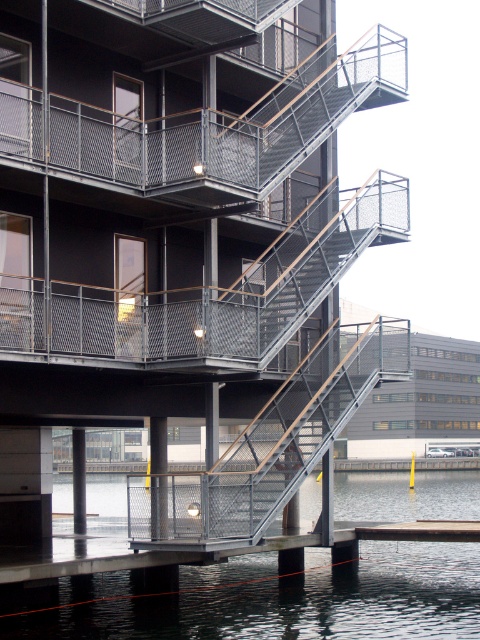
Question: Is metallic gray water at lower center to the right of black mesh balcony at upper center from the viewer's perspective?

Choices:
 (A) no
 (B) yes

Answer: (B)

Question: Does metallic gray water at lower center have a greater width compared to black mesh balcony at upper center?

Choices:
 (A) yes
 (B) no

Answer: (A)

Question: Is metallic gray water at lower center in front of black mesh balcony at upper center?

Choices:
 (A) yes
 (B) no

Answer: (B)

Question: Which point is farther to the camera?

Choices:
 (A) black mesh balcony at upper center
 (B) metallic gray water at lower center

Answer: (B)

Question: Which object appears closest to the camera in this image?

Choices:
 (A) metallic gray water at lower center
 (B) black mesh balcony at upper center

Answer: (B)